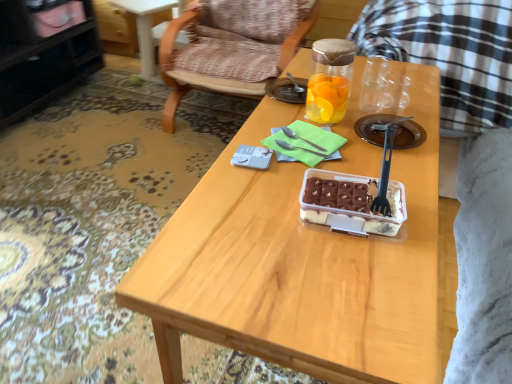
You are a GUI agent. You are given a task and a screenshot of the screen. Output one action in this format:
    pyautogui.click(x=<x>, y=<y>)
    Task: Click on the satin silver fork at center, which appears as the first fork when viewed from the back
    This screenshot has height=384, width=512.
    Given the screenshot: What is the action you would take?
    pyautogui.click(x=300, y=138)

What is the approximate width of black plastic fork at center, the 3th fork when ordered from back to front?

It is 1.39 inches.

The width and height of the screenshot is (512, 384). I want to click on wooden armchair at center, so coord(194,74).

The width and height of the screenshot is (512, 384). Describe the element at coordinates (298, 267) in the screenshot. I see `wooden table at center` at that location.

This screenshot has height=384, width=512. Identify the location of satin silver fork at center, which appears as the first fork when viewed from the back. (x=300, y=138).

Considering the positions of points (291, 131) and (201, 86), is point (291, 131) farther from camera compared to point (201, 86)?

No, it is in front of (201, 86).

Is satin silver fork at center, arranged as the 3th fork when viewed from the front, smaller than wooden armchair at center?

Yes.

Is satin silver fork at center, which appears as the first fork when viewed from the back, outside of wooden armchair at center?

Absolutely, satin silver fork at center, which appears as the first fork when viewed from the back, is external to wooden armchair at center.

From a real-world perspective, is satin silver fork at center, which appears as the first fork when viewed from the back, positioned over wooden armchair at center based on gravity?

Yes, from a real-world perspective, satin silver fork at center, which appears as the first fork when viewed from the back, is on top of wooden armchair at center.

In terms of height, does black glossy cabinet at upper left look taller or shorter compared to wooden table at center?

Considering their sizes, black glossy cabinet at upper left has more height than wooden table at center.

Identify the location of desk below the black glossy cabinet at upper left (from the image's perspective). The image size is (512, 384). (298, 267).

Is the depth of black glossy cabinet at upper left greater than that of wooden table at center?

That is True.

Which object is positioned more to the right, black glossy cabinet at upper left or wooden table at center?

wooden table at center.

Consider the image. Is transparent glass jar at center outside of black plastic fork at center, the 3th fork when ordered from back to front?

Yes.

Consider the image. Does transparent glass jar at center come behind black plastic fork at center, the 3th fork when ordered from back to front?

Yes, the depth of transparent glass jar at center is greater than that of black plastic fork at center, the 3th fork when ordered from back to front.

Measure the distance from transparent glass jar at center to black plastic fork at center, the 3th fork when ordered from back to front.

transparent glass jar at center is 24.00 centimeters away from black plastic fork at center, the 3th fork when ordered from back to front.

Is transparent glass jar at center beside black plastic fork at center, which is the first fork in front-to-back order?

No.

Does point (283, 141) lie in front of point (313, 19)?

Yes, it is in front of point (313, 19).

Can you confirm if satin silver fork at center, the second fork viewed from the back, is thinner than wooden armchair at center?

Correct, the width of satin silver fork at center, the second fork viewed from the back, is less than that of wooden armchair at center.

Relative to wooden armchair at center, is satin silver fork at center, the second fork viewed from the back, in front or behind?

Clearly, satin silver fork at center, the second fork viewed from the back, is in front of wooden armchair at center.

Based on the photo, choose the correct answer: Is satin silver fork at center, the second fork viewed from the back, inside wooden armchair at center or outside it?

The correct answer is: outside.

From the image's perspective, does satin silver fork at center, the second fork in the front-to-back sequence, appear higher than black glossy cabinet at upper left?

No, from the image's perspective, satin silver fork at center, the second fork in the front-to-back sequence, is not on top of black glossy cabinet at upper left.

Considering the relative sizes of satin silver fork at center, the second fork viewed from the back, and black glossy cabinet at upper left in the image provided, is satin silver fork at center, the second fork viewed from the back, shorter than black glossy cabinet at upper left?

Indeed, satin silver fork at center, the second fork viewed from the back, has a lesser height compared to black glossy cabinet at upper left.

Is black glossy cabinet at upper left at the back of satin silver fork at center, the second fork in the front-to-back sequence?

No, black glossy cabinet at upper left is not at the back of satin silver fork at center, the second fork in the front-to-back sequence.

Does black plastic fork at center, which is the first fork in front-to-back order, appear on the left side of satin silver fork at center, the second fork viewed from the back?

Incorrect, black plastic fork at center, which is the first fork in front-to-back order, is not on the left side of satin silver fork at center, the second fork viewed from the back.

From the image's perspective, is black plastic fork at center, which is the first fork in front-to-back order, located above satin silver fork at center, the second fork in the front-to-back sequence?

No.

How much distance is there between black plastic fork at center, which is the first fork in front-to-back order, and satin silver fork at center, the second fork in the front-to-back sequence?

7.99 inches.

Would you say black plastic fork at center, which is the first fork in front-to-back order, is inside or outside satin silver fork at center, the second fork viewed from the back?

black plastic fork at center, which is the first fork in front-to-back order, is outside satin silver fork at center, the second fork viewed from the back.

The image size is (512, 384). In order to click on bowl below the transparent glass jar at center (from the image's perspective) in this screenshot , I will do `click(350, 203)`.

From the image's perspective, is translucent plastic container at center located above or below transparent glass jar at center?

Clearly, from the image's perspective, translucent plastic container at center is below transparent glass jar at center.

Is translucent plastic container at center facing towards transparent glass jar at center?

No, translucent plastic container at center is not oriented towards transparent glass jar at center.

Is translucent plastic container at center not close to transparent glass jar at center?

No, translucent plastic container at center is not far away from transparent glass jar at center.

Locate an element on the screen. Image resolution: width=512 pixels, height=384 pixels. the 1st fork below when counting from the wooden armchair at center (from the image's perspective) is located at coordinates (300, 138).

The image size is (512, 384). Identify the location of cabinetry that is above the wooden table at center (from a real-world perspective). (41, 60).

From the image, which object appears to be farther from satin silver fork at center, arranged as the 3th fork when viewed from the front, wooden armchair at center or transparent glass jar at center?

wooden armchair at center lies further to satin silver fork at center, arranged as the 3th fork when viewed from the front, than the other object.

From the image, which object appears to be farther from transparent glass jar at center, black glossy cabinet at upper left or satin silver fork at center, which appears as the first fork when viewed from the back?

black glossy cabinet at upper left.

When comparing their distances from satin silver fork at center, arranged as the 3th fork when viewed from the front, does wooden armchair at center or black glossy cabinet at upper left seem closer?

Among the two, wooden armchair at center is located nearer to satin silver fork at center, arranged as the 3th fork when viewed from the front.

Estimate the real-world distances between objects in this image. Which object is closer to translucent plastic container at center, wooden table at center or black glossy cabinet at upper left?

Based on the image, wooden table at center appears to be nearer to translucent plastic container at center.

From the image, which object appears to be farther from black glossy cabinet at upper left, wooden armchair at center or translucent plastic container at center?

translucent plastic container at center lies further to black glossy cabinet at upper left than the other object.

When comparing their distances from translucent plastic container at center, does wooden armchair at center or satin silver fork at center, the second fork in the front-to-back sequence, seem further?

wooden armchair at center.

Looking at the image, which one is located further to translucent plastic container at center, transparent glass jar at center or satin silver fork at center, the second fork viewed from the back?

transparent glass jar at center is further to translucent plastic container at center.

Looking at the image, which one is located further to satin silver fork at center, the second fork in the front-to-back sequence, black plastic fork at center, the 3th fork when ordered from back to front, or black glossy cabinet at upper left?

black glossy cabinet at upper left lies further to satin silver fork at center, the second fork in the front-to-back sequence, than the other object.

You are a GUI agent. You are given a task and a screenshot of the screen. Output one action in this format:
    pyautogui.click(x=<x>, y=<y>)
    Task: Click on the bowl located between black glossy cabinet at upper left and wooden table at center in the left-right direction
    
    Given the screenshot: What is the action you would take?
    pyautogui.click(x=350, y=203)

Identify the location of fork located between black plastic fork at center, the 3th fork when ordered from back to front, and satin silver fork at center, which appears as the first fork when viewed from the back, in the depth direction. (300, 149).

What are the coordinates of `bottle between black plastic fork at center, the 3th fork when ordered from back to front, and satin silver fork at center, arranged as the 3th fork when viewed from the front, along the z-axis` in the screenshot? It's located at (330, 80).

At what (x,y) coordinates should I click in order to perform the action: click on fork between wooden armchair at center and satin silver fork at center, the second fork viewed from the back, in the vertical direction. Please return your answer as a coordinate pair (x, y). The image size is (512, 384). Looking at the image, I should click on pos(300,138).